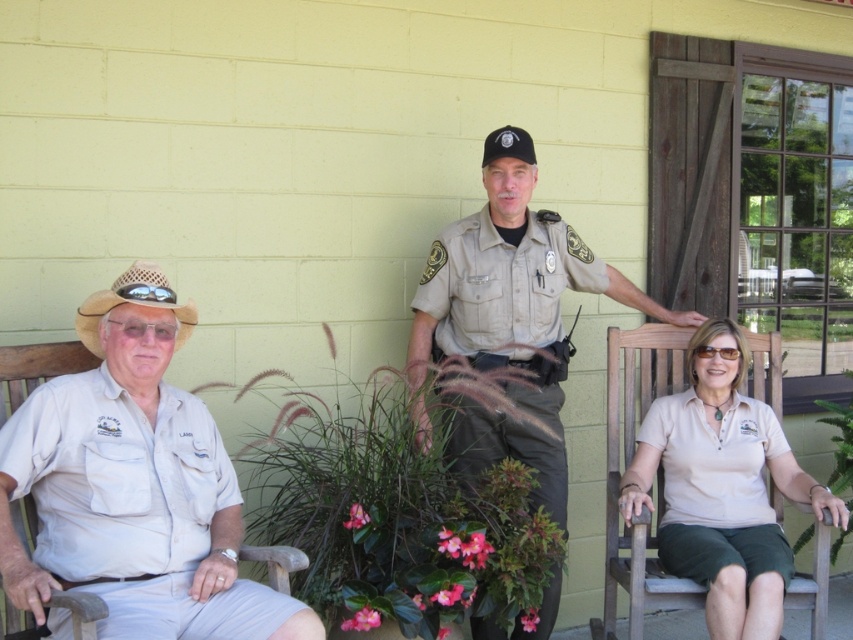
Question: Which of these objects is positioned closest to the beige cotton shirt at lower right?

Choices:
 (A) tan uniform at center
 (B) tan straw cowboy hat at left
 (C) beige fabric shirt at center
 (D) beige fabric shirt at left

Answer: (C)

Question: Can you confirm if tan uniform at center is smaller than tan straw cowboy hat at left?

Choices:
 (A) no
 (B) yes

Answer: (A)

Question: Is tan uniform at center behind tan straw cowboy hat at left?

Choices:
 (A) no
 (B) yes

Answer: (B)

Question: Is beige fabric shirt at left positioned before tan uniform at center?

Choices:
 (A) no
 (B) yes

Answer: (B)

Question: Which of the following is the closest to the observer?

Choices:
 (A) tan straw cowboy hat at left
 (B) beige fabric shirt at left
 (C) tan uniform at center

Answer: (B)

Question: Among these points, which one is nearest to the camera?

Choices:
 (A) (767, 566)
 (B) (164, 305)
 (C) (96, 525)

Answer: (C)